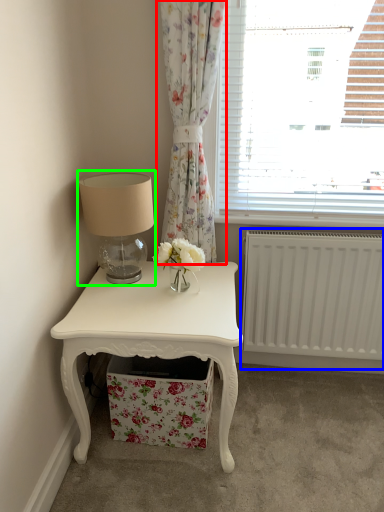
Question: Which object is positioned closest to curtain (highlighted by a red box)? Select from radiator (highlighted by a blue box) and table lamp (highlighted by a green box).

Choices:
 (A) radiator
 (B) table lamp

Answer: (B)